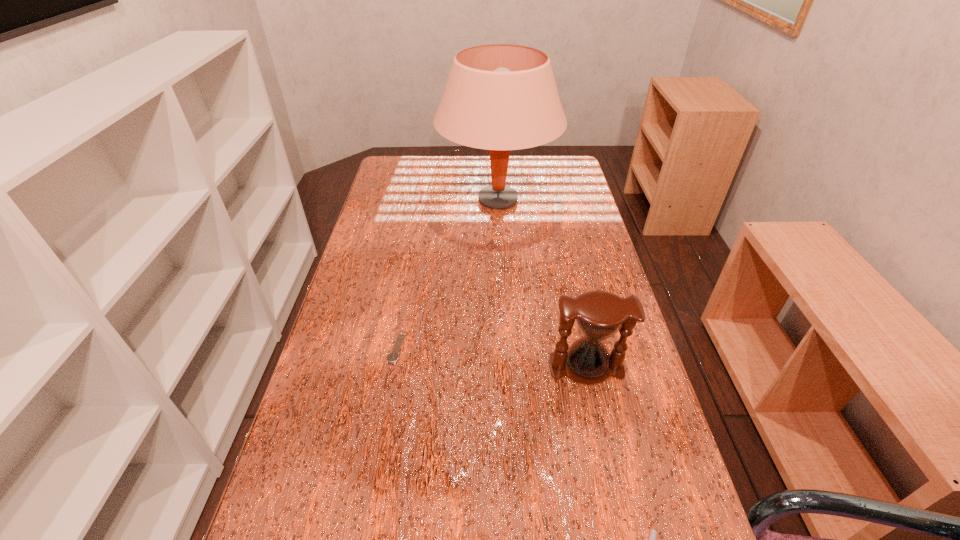
This screenshot has width=960, height=540. What are the coordinates of `free space that is in between the left watch and the farthest object` in the screenshot? It's located at (447, 274).

This screenshot has height=540, width=960. What are the coordinates of `free area in between the second tallest object and the leftmost object` in the screenshot? It's located at (492, 357).

Where is `vacant area between the farthest object and the second tallest object`? vacant area between the farthest object and the second tallest object is located at coordinates (541, 284).

Where is `object that can be found as the third closest to the right watch`? object that can be found as the third closest to the right watch is located at coordinates (500, 97).

Where is `the second closest object to the right watch`? The width and height of the screenshot is (960, 540). the second closest object to the right watch is located at coordinates (393, 356).

This screenshot has height=540, width=960. Find the location of `vacant area that satisfies the following two spatial constraints: 1. on the front-facing side of the hourglass; 2. on the left side of the farthest object`. vacant area that satisfies the following two spatial constraints: 1. on the front-facing side of the hourglass; 2. on the left side of the farthest object is located at coordinates (507, 368).

Locate an element on the screen. This screenshot has width=960, height=540. free spot that satisfies the following two spatial constraints: 1. on the front-facing side of the hourglass; 2. on the left side of the lampshade is located at coordinates point(507,368).